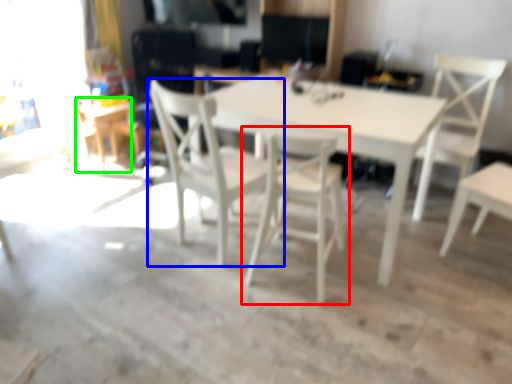
Question: Considering the real-world distances, which object is closest to chair (highlighted by a red box)? chair (highlighted by a blue box) or table (highlighted by a green box).

Choices:
 (A) chair
 (B) table

Answer: (A)